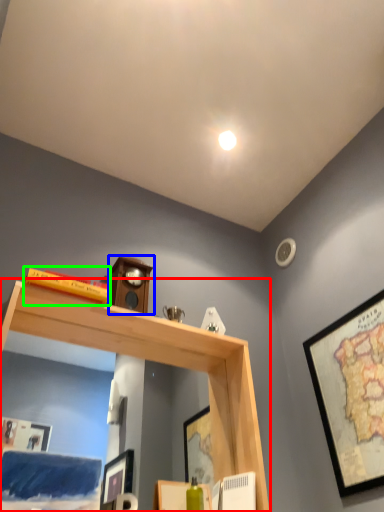
Question: Based on their relative distances, which object is farther from shelf (highlighted by a red box)? Choose from clock (highlighted by a blue box) and book (highlighted by a green box).

Choices:
 (A) clock
 (B) book

Answer: (B)